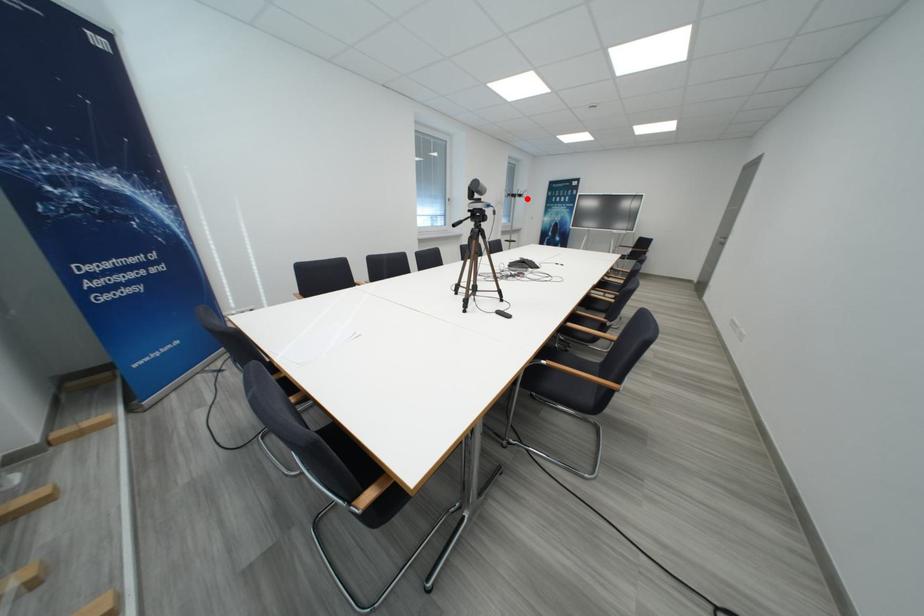
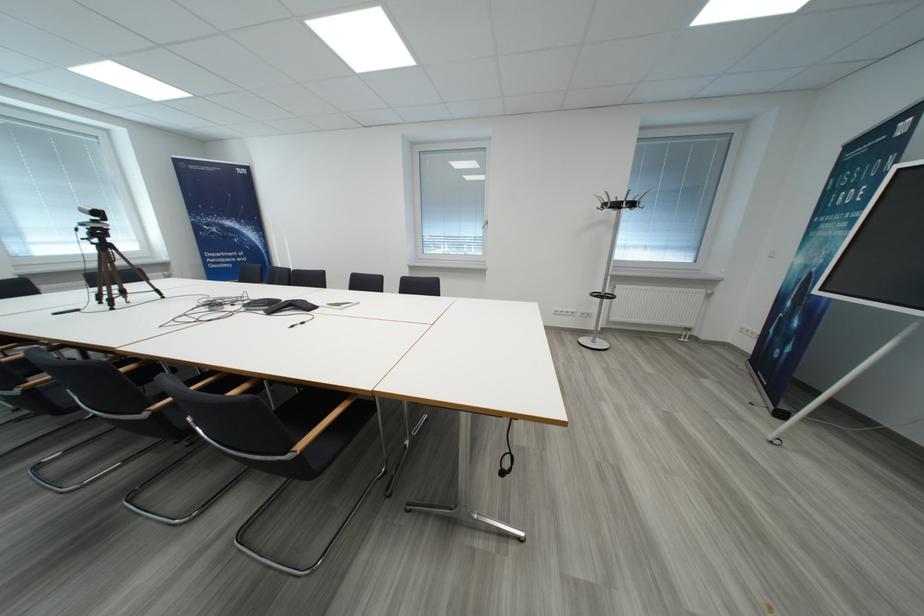
Where in the second image is the point corresponding to the highlighted location from the first image?

(623, 208)